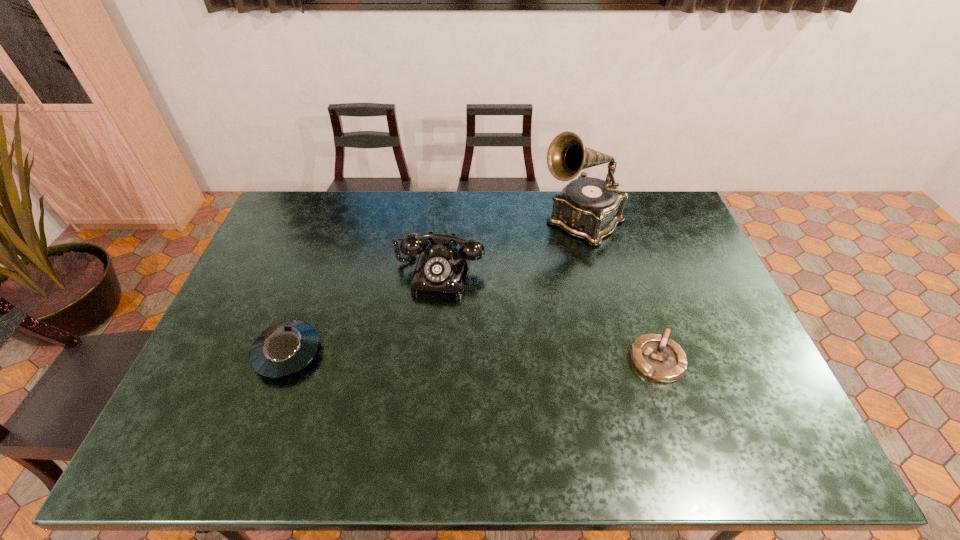
Where is `vacant spot on the desktop that is between the saucer and the ashtray and is positioned on the dial of the second object from left to right`? The width and height of the screenshot is (960, 540). vacant spot on the desktop that is between the saucer and the ashtray and is positioned on the dial of the second object from left to right is located at coordinates 419,355.

Find the location of a particular element. Image resolution: width=960 pixels, height=540 pixels. free spot on the desktop that is between the second shortest object and the shortest object and is positioned on the horn of the phonograph record is located at coordinates (430, 356).